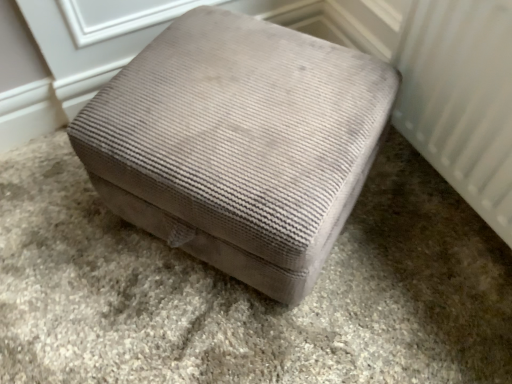
Find the location of a particular element. vacant area that lies to the right of velvet ottoman at center is located at coordinates (409, 263).